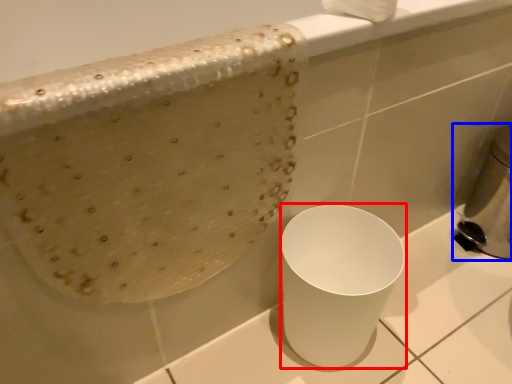
Question: Among these objects, which one is farthest to the camera, porcelain (highlighted by a red box) or appliance (highlighted by a blue box)?

Choices:
 (A) porcelain
 (B) appliance

Answer: (B)